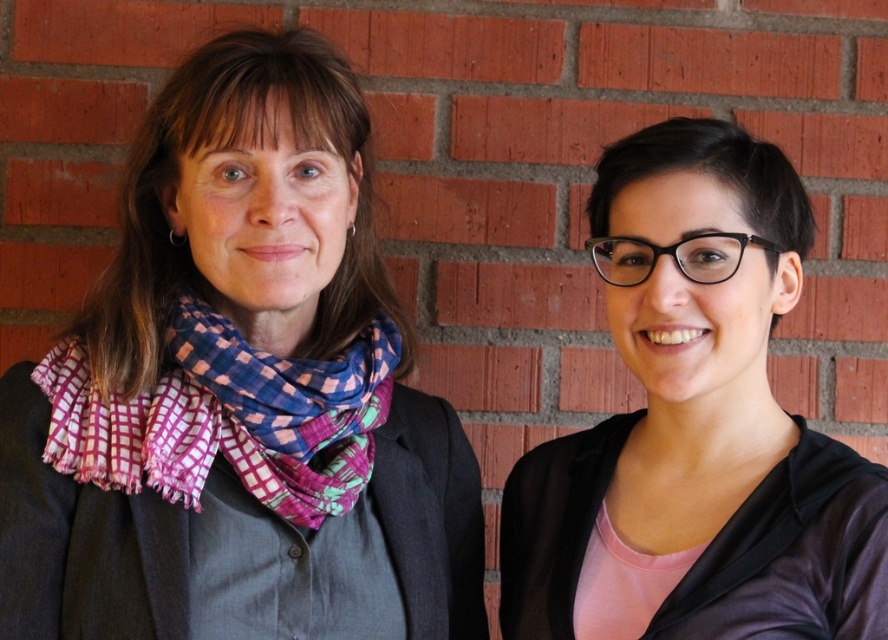
Question: Which is nearer to the black glossy glasses at upper right?

Choices:
 (A) multicolored woven scarf at left
 (B) multicolored woven scarf at center

Answer: (B)

Question: Based on their relative distances, which object is nearer to the multicolored woven scarf at left?

Choices:
 (A) multicolored woven scarf at center
 (B) black glossy glasses at upper right

Answer: (A)

Question: Which object appears closest to the camera in this image?

Choices:
 (A) multicolored woven scarf at left
 (B) black glossy glasses at upper right

Answer: (B)

Question: Does multicolored woven scarf at center appear under multicolored woven scarf at left?

Choices:
 (A) yes
 (B) no

Answer: (B)

Question: Can you confirm if multicolored woven scarf at center is positioned to the right of black glossy glasses at upper right?

Choices:
 (A) no
 (B) yes

Answer: (A)

Question: Considering the relative positions of multicolored woven scarf at center and multicolored woven scarf at left in the image provided, where is multicolored woven scarf at center located with respect to multicolored woven scarf at left?

Choices:
 (A) right
 (B) left

Answer: (B)